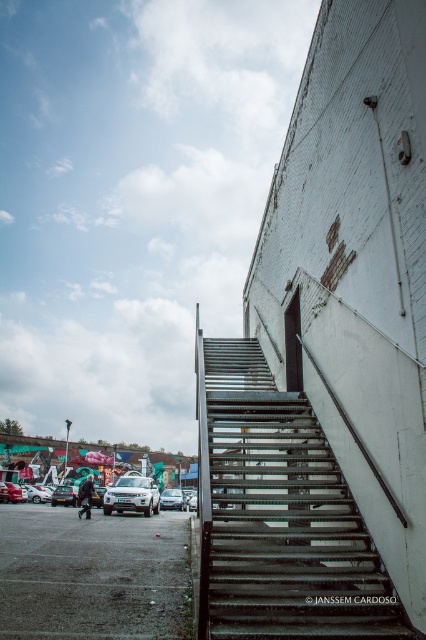
Question: Does white matte suv at lower center appear over dark blue leather jacket at lower left?

Choices:
 (A) yes
 (B) no

Answer: (A)

Question: Which object is farther from the camera taking this photo?

Choices:
 (A) satin silver sedan at center
 (B) white matte suv at lower center

Answer: (A)

Question: Is dark asphalt parking lot at lower left closer to the viewer compared to silver metallic suv at lower center?

Choices:
 (A) yes
 (B) no

Answer: (A)

Question: Can you confirm if white matte suv at lower center is smaller than dark blue leather jacket at lower left?

Choices:
 (A) no
 (B) yes

Answer: (B)

Question: Which object is positioned closest to the satin silver sedan at center?

Choices:
 (A) silver metallic suv at lower center
 (B) white matte suv at lower center
 (C) metallic gray stairs at center
 (D) dark blue leather jacket at lower left

Answer: (A)

Question: Among these objects, which one is farthest from the camera?

Choices:
 (A) metallic gray stairs at center
 (B) silver metallic suv at lower center

Answer: (B)